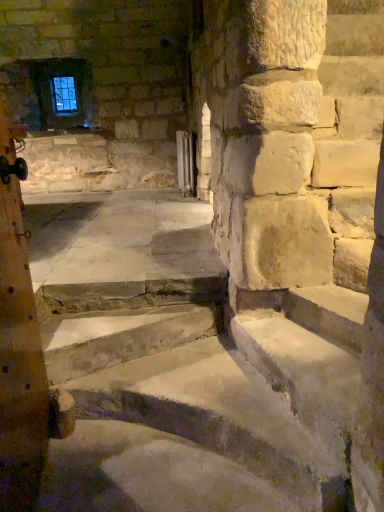
Question: Is smooth stone stairs at center facing towards metallic radiator at center?

Choices:
 (A) yes
 (B) no

Answer: (B)

Question: Is smooth stone stairs at center not close to metallic radiator at center?

Choices:
 (A) yes
 (B) no

Answer: (A)

Question: Can you confirm if smooth stone stairs at center is smaller than metallic radiator at center?

Choices:
 (A) no
 (B) yes

Answer: (A)

Question: Would you say smooth stone stairs at center contains metallic radiator at center?

Choices:
 (A) no
 (B) yes

Answer: (A)

Question: From the image's perspective, does smooth stone stairs at center appear higher than metallic radiator at center?

Choices:
 (A) no
 (B) yes

Answer: (A)

Question: From a real-world perspective, relative to wooden post at left, is clear glass window screen at upper left vertically above or below?

Choices:
 (A) below
 (B) above

Answer: (B)

Question: From the image's perspective, is clear glass window screen at upper left positioned above or below wooden post at left?

Choices:
 (A) above
 (B) below

Answer: (A)

Question: Does point (66, 94) appear closer or farther from the camera than point (6, 194)?

Choices:
 (A) farther
 (B) closer

Answer: (A)

Question: Relative to wooden post at left, is clear glass window screen at upper left in front or behind?

Choices:
 (A) behind
 (B) front

Answer: (A)

Question: Is wooden post at left spatially inside clear glass window screen at upper left, or outside of it?

Choices:
 (A) outside
 (B) inside

Answer: (A)

Question: Considering the positions of wooden post at left and clear glass window screen at upper left in the image, is wooden post at left wider or thinner than clear glass window screen at upper left?

Choices:
 (A) wide
 (B) thin

Answer: (A)

Question: Relative to clear glass window screen at upper left, is wooden post at left in front or behind?

Choices:
 (A) front
 (B) behind

Answer: (A)

Question: From a real-world perspective, is wooden post at left physically located above or below clear glass window screen at upper left?

Choices:
 (A) below
 (B) above

Answer: (A)

Question: From the image's perspective, relative to wooden post at left, is metallic radiator at center above or below?

Choices:
 (A) above
 (B) below

Answer: (A)

Question: From a real-world perspective, is metallic radiator at center positioned above or below wooden post at left?

Choices:
 (A) below
 (B) above

Answer: (B)